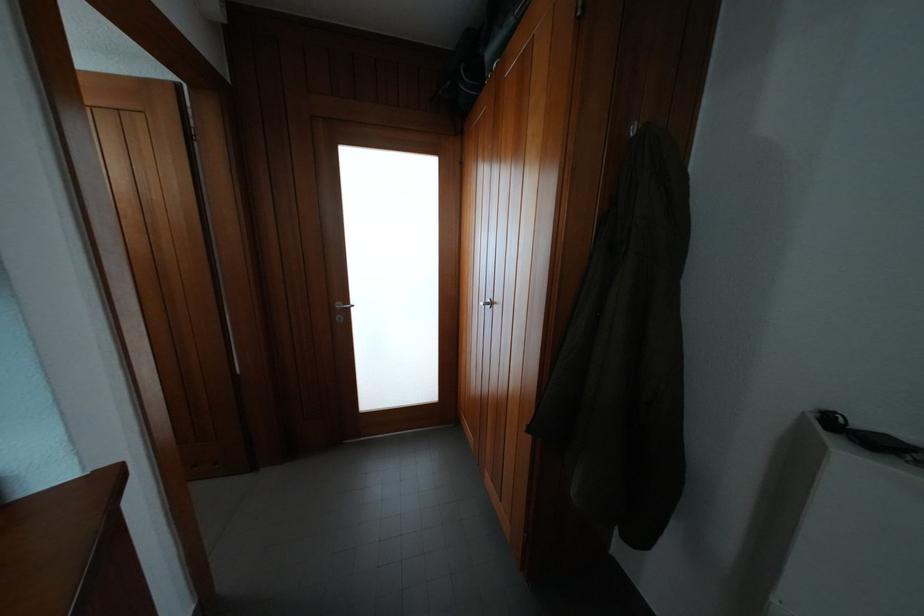
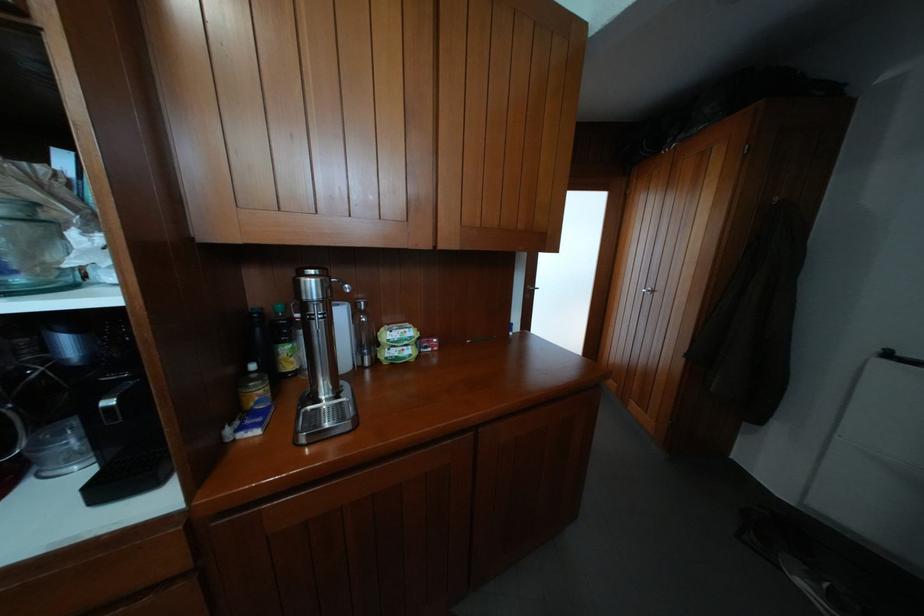
From the picture: In a continuous first-person perspective shot, in which direction is the camera moving?

The cameraman moved toward left, backward.